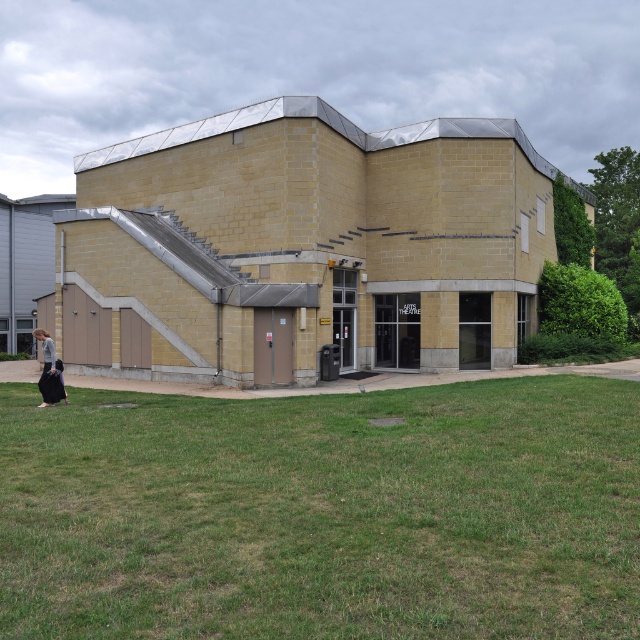
You are standing in front of the modern building and see the green grass at lower center and the black fabric bag at lower left. Which object is closer to the building?

The green grass at lower center is closer to the building because it is positioned to the right of the black fabric bag at lower left, which is further away.

You are standing in front of the modern building and notice the green grass at lower center and the dark gray fabric bag at lower left. Which object is nearer to you?

The green grass at lower center is closer to the viewer than the dark gray fabric bag at lower left.

You are standing at the entrance of the modern building and want to find the green grass at lower center. According to the coordinates provided, in which direction should you move from your current position to locate it?

The green grass at lower center is located at point (323,513), which means it is to the right and slightly forward from your current position at the entrance. Move towards the right side of the building to find it.